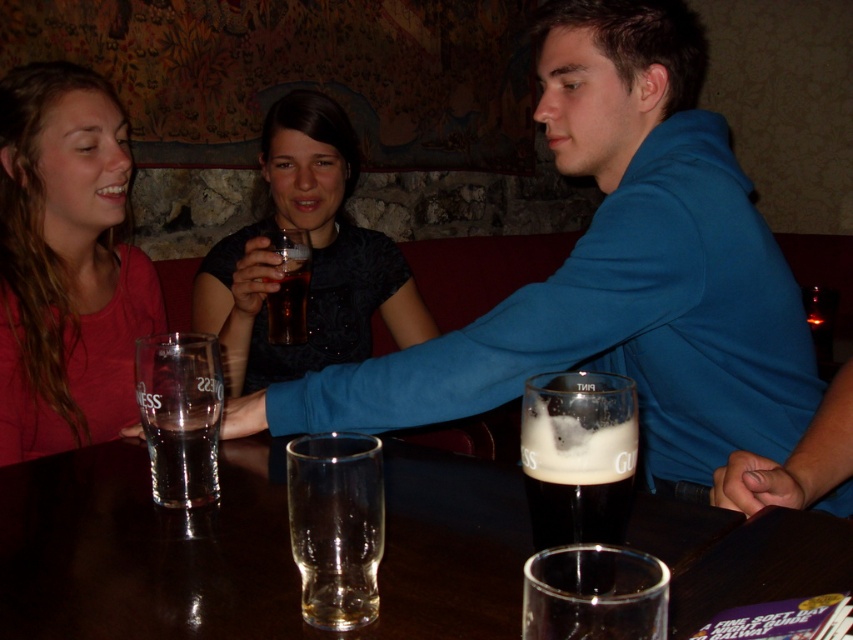
Question: Can you confirm if transparent glass at center is smaller than clear glass beer at center?

Choices:
 (A) yes
 (B) no

Answer: (B)

Question: Is matte pink shirt at upper left wider than dark brown glass at center?

Choices:
 (A) no
 (B) yes

Answer: (B)

Question: Can you confirm if matte black dress at center is positioned to the right of clear glass beer at center?

Choices:
 (A) no
 (B) yes

Answer: (A)

Question: Which object appears closest to the camera in this image?

Choices:
 (A) clear glass beer at center
 (B) translucent glass at center

Answer: (A)

Question: Which object appears closest to the camera in this image?

Choices:
 (A) clear glass at left
 (B) matte black dress at center
 (C) blue cotton shirt at upper right
 (D) transparent glass at center

Answer: (D)

Question: Among these objects, which one is farthest from the camera?

Choices:
 (A) clear glass beer at center
 (B) dark brown glass at center

Answer: (A)